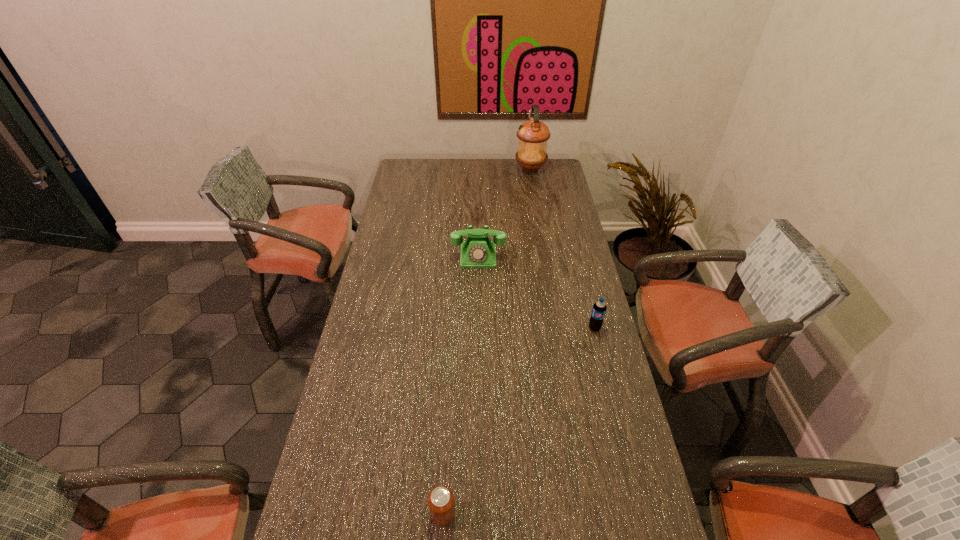
At what (x,y) coordinates should I click in order to perform the action: click on vacant area that satisfies the following two spatial constraints: 1. on the dial of the telephone; 2. on the right side of the third farthest object. Please return your answer as a coordinate pair (x, y). The image size is (960, 540). Looking at the image, I should click on (478, 328).

Locate an element on the screen. vacant position in the image that satisfies the following two spatial constraints: 1. on the dial of the third nearest object; 2. on the right side of the rightmost object is located at coordinates (478, 328).

Locate an element on the screen. The width and height of the screenshot is (960, 540). vacant region that satisfies the following two spatial constraints: 1. on the front side of the second nearest object; 2. on the right side of the oil lamp is located at coordinates (557, 328).

Identify the location of vacant region that satisfies the following two spatial constraints: 1. on the front side of the third object from left to right; 2. on the left side of the rightmost object. The width and height of the screenshot is (960, 540). (557, 328).

At what (x,y) coordinates should I click in order to perform the action: click on vacant point that satisfies the following two spatial constraints: 1. on the dial of the second farthest object; 2. on the right side of the soda bottle. Please return your answer as a coordinate pair (x, y). Looking at the image, I should click on (478, 328).